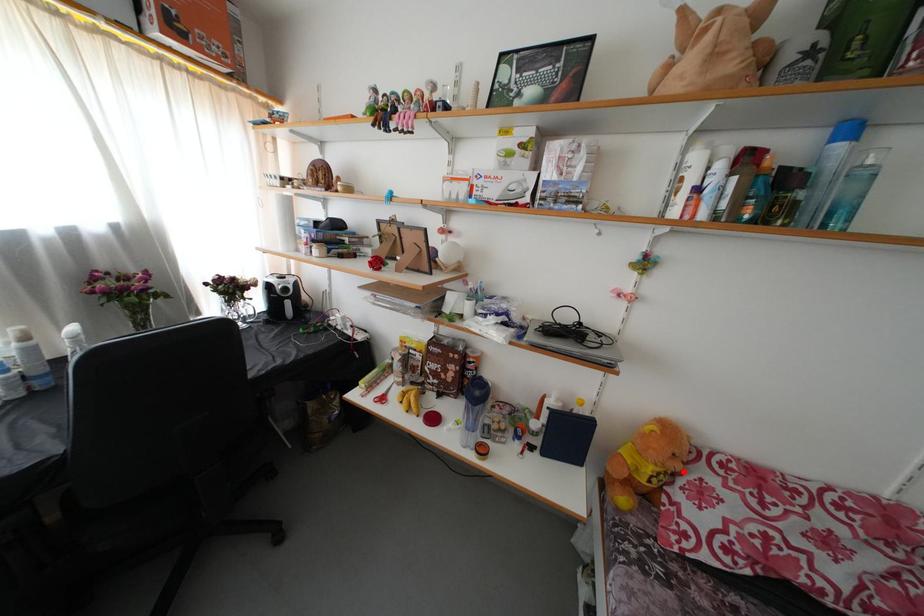
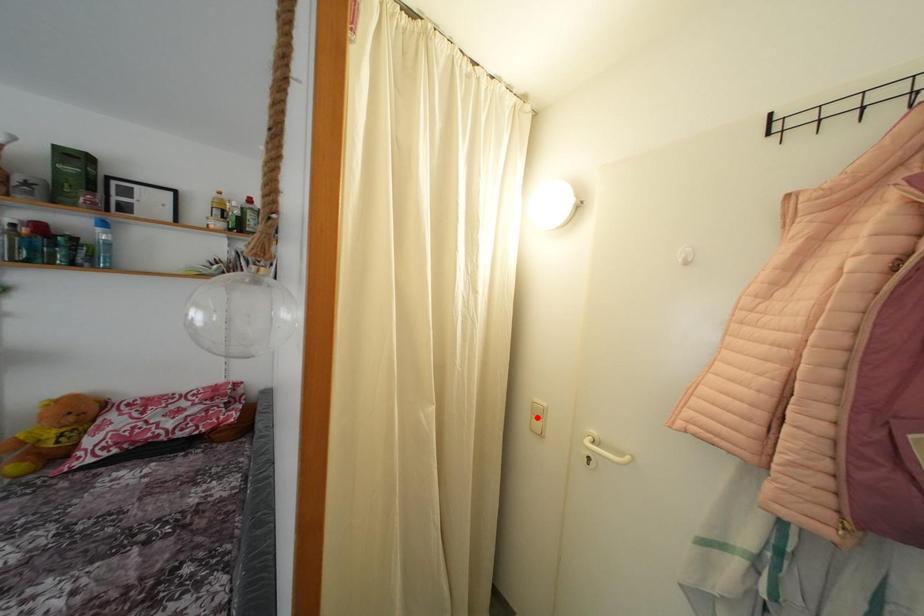
I am providing you with two images of the same scene from different viewpoints. A red point is marked on the first image and another point is marked on the second image. Are the points marked in image1 and image2 representing the same 3D position?

No